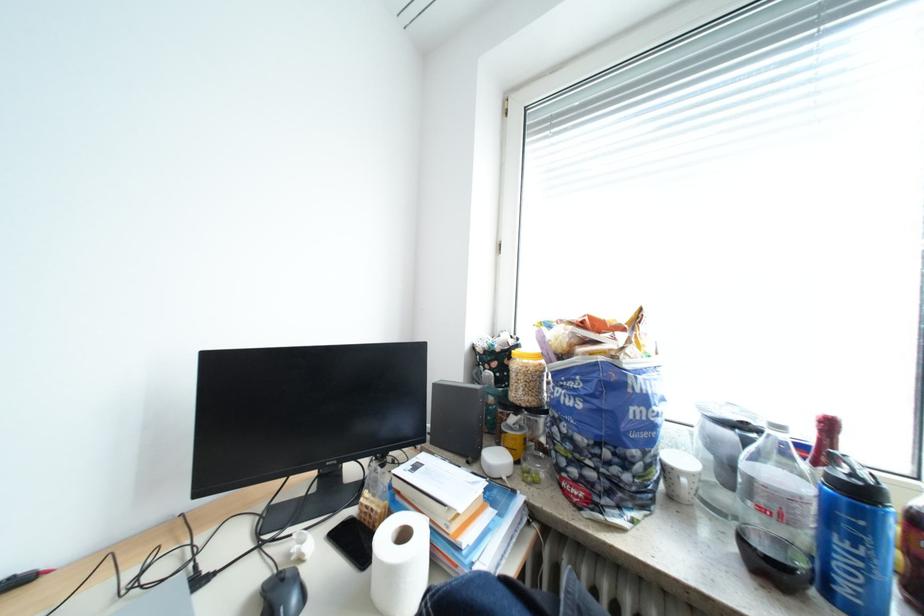
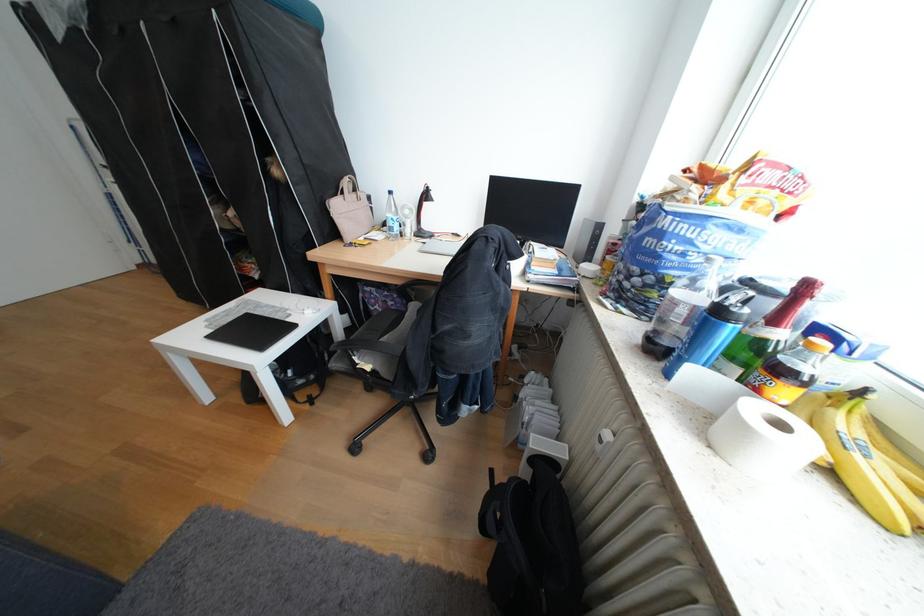
Where in the second image is the point corresponding to (x=843, y=426) from the first image?

(819, 288)